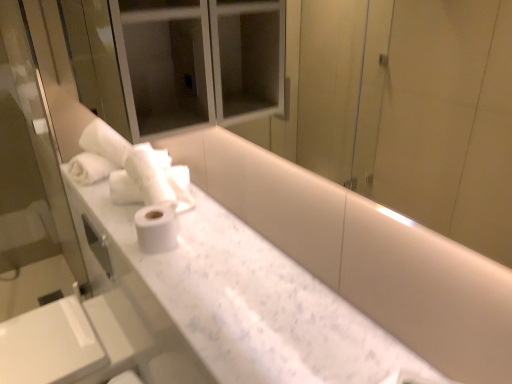
Question: Is white marble counter at center in front of or behind white soft towel at upper left in the image?

Choices:
 (A) front
 (B) behind

Answer: (A)

Question: In terms of height, does white marble counter at center look taller or shorter compared to white soft towel at upper left?

Choices:
 (A) tall
 (B) short

Answer: (B)

Question: Based on their relative distances, which object is farther from the white marble counter at center?

Choices:
 (A) white soft towel at upper left
 (B) white marble sink at lower left
 (C) white matte toilet paper at center

Answer: (B)

Question: Which is farther from the white soft towel at upper left?

Choices:
 (A) white marble sink at lower left
 (B) white matte toilet paper at center
 (C) white marble counter at center

Answer: (A)